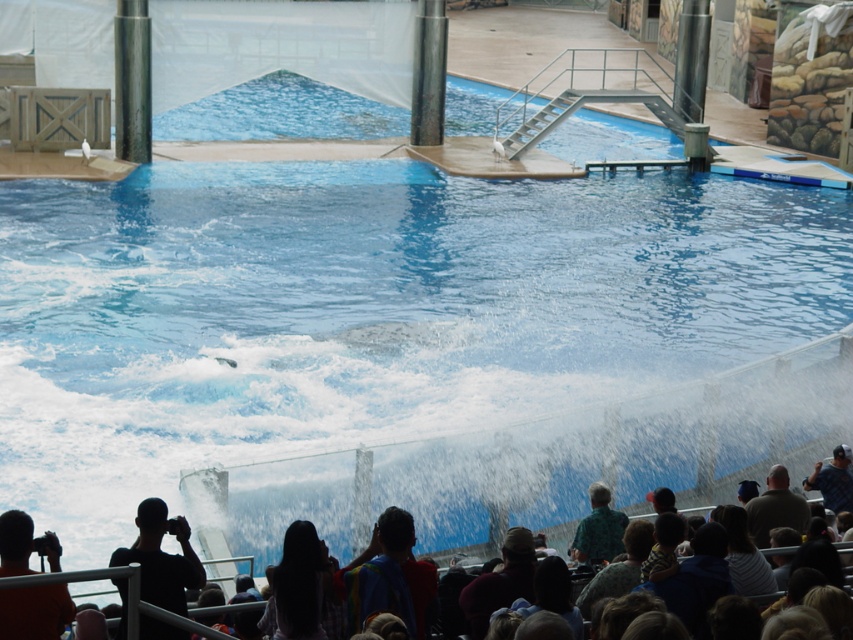
You are a photographer at the marine show. You need to take a photo of the orange shirt at lower left and brown fabric hat at lower center. Which object should you focus on first if you want to capture both in one frame without zooming in or out?

The orange shirt at lower left is bigger than the brown fabric hat at lower center, so you should focus on the orange shirt at lower left first to ensure it fits properly in the frame before adjusting for the smaller brown fabric hat at lower center.

You are a photographer trying to capture the dolphin mid jump. You are standing behind the orange shirt at lower left and the brown fabric hat at lower center. Which object is blocking your view of the dolphin?

The orange shirt at lower left is closer to the viewer than the brown fabric hat at lower center, so the orange shirt at lower left is blocking your view of the dolphin.

You are a photographer standing at the front row of the dolphin show. You want to take a photo of both the dolphin and the audience. The dolphin is at point (19, 522) and the audience is at point (527, 577). Which point is closer to you so that you can focus on it first?

Point (19, 522) is closer to the camera than point (527, 577), so you can focus on the dolphin first before adjusting the focus to the audience at point (527, 577).